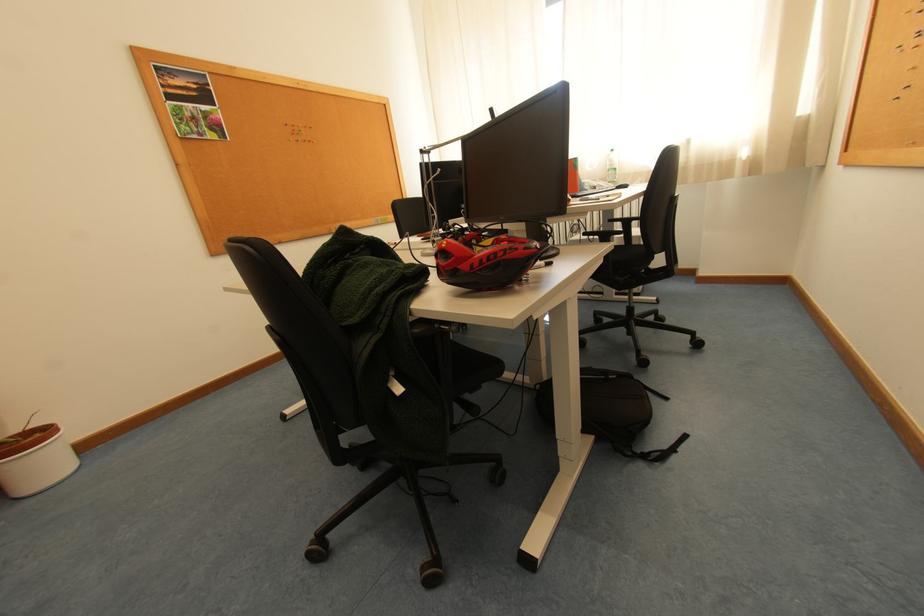
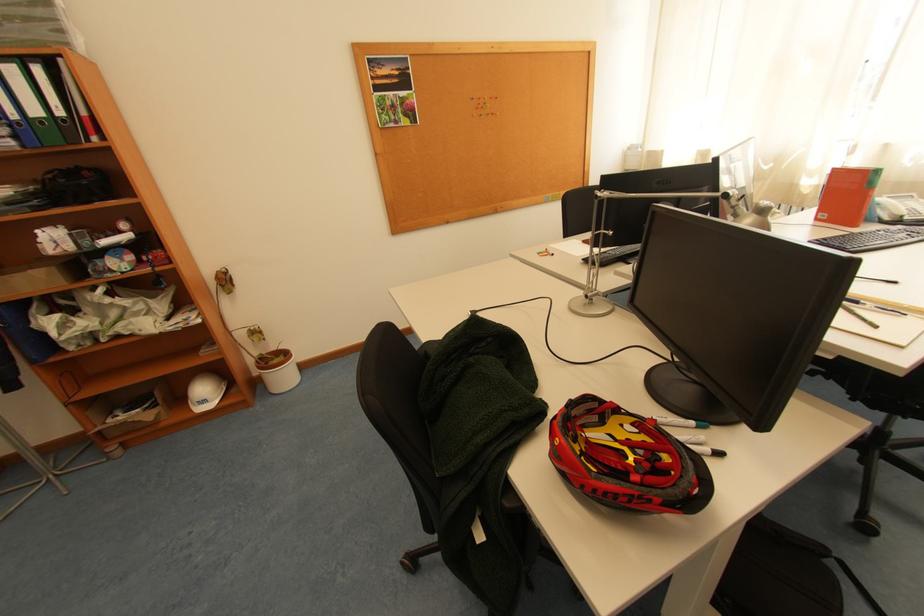
Locate, in the second image, the point that corresponds to pixel 453 246 in the first image.

(565, 445)